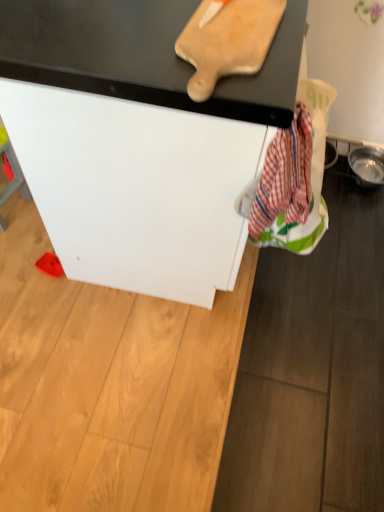
Question: Does white matte cabinet at center have a larger size compared to wooden cutting board at upper center?

Choices:
 (A) no
 (B) yes

Answer: (B)

Question: Is white matte cabinet at center smaller than wooden cutting board at upper center?

Choices:
 (A) yes
 (B) no

Answer: (B)

Question: Is white matte cabinet at center further to the viewer compared to wooden cutting board at upper center?

Choices:
 (A) yes
 (B) no

Answer: (B)

Question: Can you confirm if white matte cabinet at center is wider than wooden cutting board at upper center?

Choices:
 (A) no
 (B) yes

Answer: (B)

Question: Does white matte cabinet at center turn towards wooden cutting board at upper center?

Choices:
 (A) no
 (B) yes

Answer: (A)

Question: Does white matte cabinet at center have a lesser height compared to wooden cutting board at upper center?

Choices:
 (A) no
 (B) yes

Answer: (A)

Question: From a real-world perspective, is white matte cabinet at center located higher than red plaid fabric at lower right?

Choices:
 (A) no
 (B) yes

Answer: (A)

Question: Can you confirm if white matte cabinet at center is wider than red plaid fabric at lower right?

Choices:
 (A) no
 (B) yes

Answer: (B)

Question: Does white matte cabinet at center have a lesser height compared to red plaid fabric at lower right?

Choices:
 (A) no
 (B) yes

Answer: (A)

Question: From the image's perspective, is white matte cabinet at center above red plaid fabric at lower right?

Choices:
 (A) yes
 (B) no

Answer: (A)

Question: Is white matte cabinet at center behind red plaid fabric at lower right?

Choices:
 (A) yes
 (B) no

Answer: (B)

Question: Could red plaid fabric at lower right be considered to be inside white matte cabinet at center?

Choices:
 (A) no
 (B) yes

Answer: (B)

Question: From the image's perspective, does wooden cutting board at upper center appear higher than red plaid fabric at lower right?

Choices:
 (A) yes
 (B) no

Answer: (A)